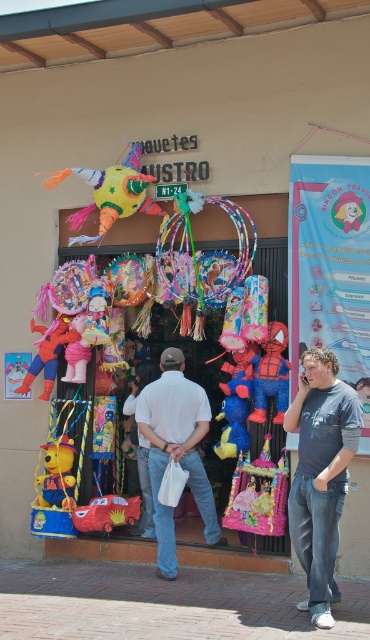
Between matte red spiderman at center and matte red car at center, which one is positioned higher?

matte red spiderman at center is above.

In order to click on matte red spiderman at center in this screenshot , I will do (48, 353).

Where is `matte red spiderman at center`? matte red spiderman at center is located at coordinates (48, 353).

Does point (330, 545) lie behind point (153, 202)?

No, it is not.

Is denim jeans at lower right shorter than multicolored paper piñata at center?

In fact, denim jeans at lower right may be taller than multicolored paper piñata at center.

Is point (311, 394) positioned after point (111, 192)?

No.

You are a GUI agent. You are given a task and a screenshot of the screen. Output one action in this format:
    pyautogui.click(x=<x>, y=<y>)
    Task: Click on the denim jeans at lower right
    This screenshot has height=640, width=370.
    Given the screenshot: What is the action you would take?
    point(321,474)

Can you confirm if velvet plush spiderman at center is smaller than matte red car at center?

Yes, velvet plush spiderman at center is smaller than matte red car at center.

Which is in front, point (270, 332) or point (139, 512)?

Positioned in front is point (270, 332).

At what (x,y) coordinates should I click in order to perform the action: click on velvet plush spiderman at center. Please return your answer as a coordinate pair (x, y). This screenshot has width=370, height=640. Looking at the image, I should click on (270, 374).